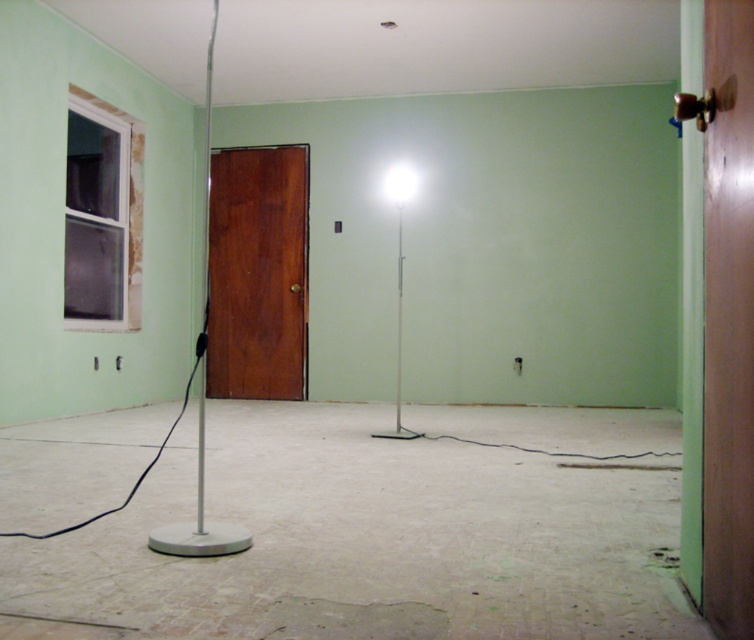
You are standing in the room and want to exit through the shiny brown door at center. The white glossy floor lamp at center is blocking your path. Can you walk around it to reach the door?

The shiny brown door at center is further to the viewer than the white glossy floor lamp at center, so you can walk around the white glossy floor lamp at center to reach the shiny brown door at center.